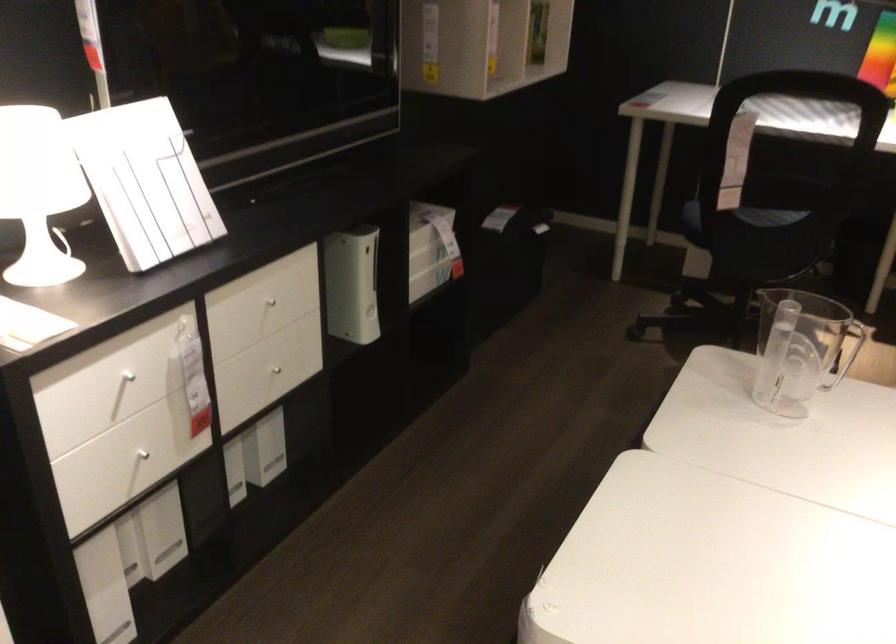
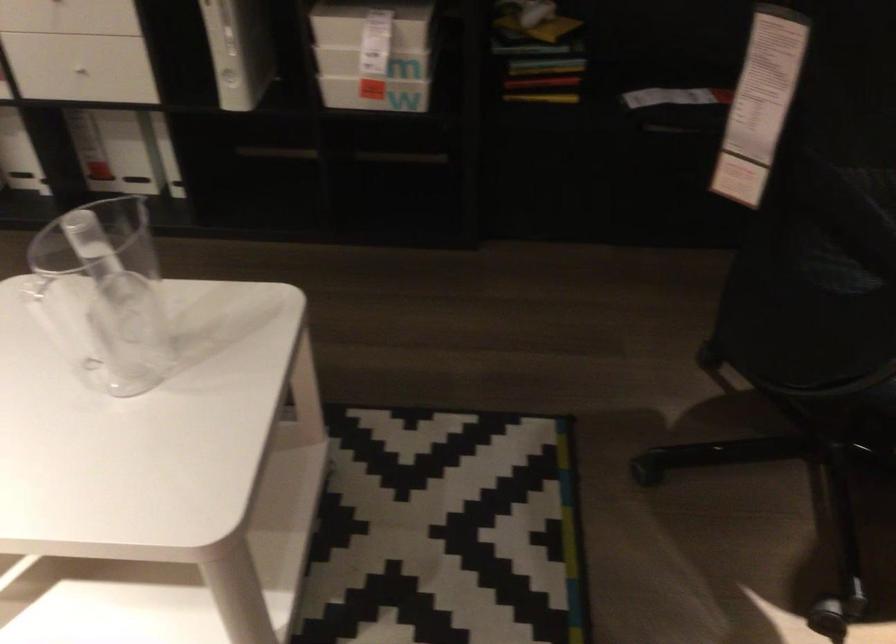
The point at (x=228, y=411) is marked in the first image. Where is the corresponding point in the second image?

(75, 77)